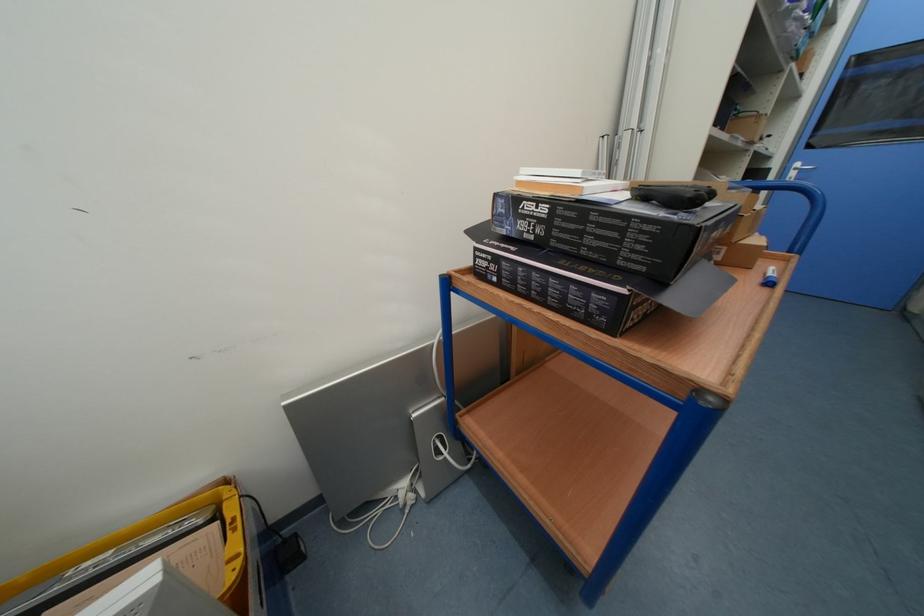
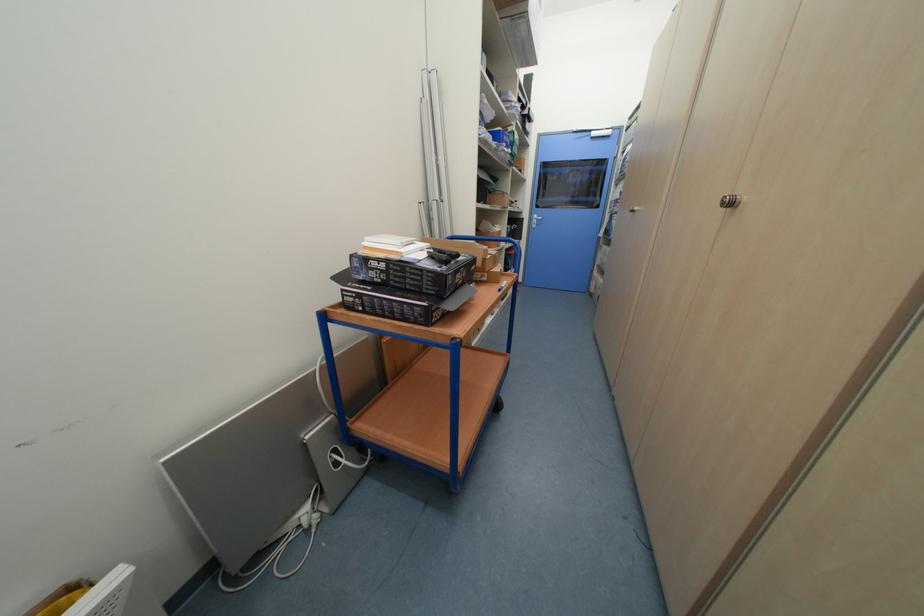
Locate, in the second image, the point that corresponds to point 588,235 in the first image.

(410, 278)